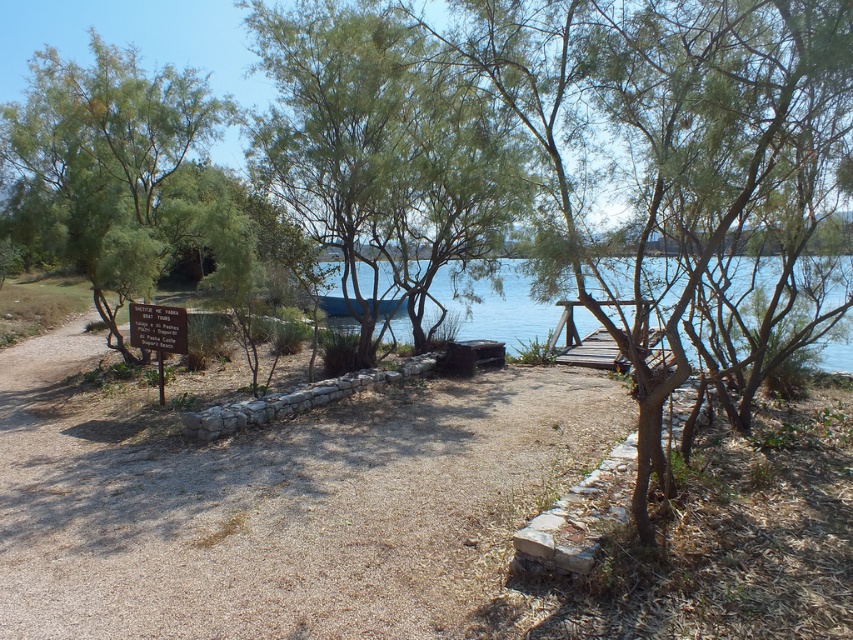
You are a hiker who wants to reach the boat tours area. You see the brown gravel path at center and the white wooden sign at lower left. Which object should you follow or look at for guidance?

The white wooden sign at lower left provides information about boat tours, so you should look at it for guidance. The brown gravel path at center is in front of the sign, but the sign itself contains the relevant information.

You are standing at the wooden signpost to the left of the dirt path. You want to walk to the green leafy tree at center. Which direction should you walk?

You should walk towards the center of the image to reach the green leafy tree at center, which is located at point coordinates of (x=381, y=148).